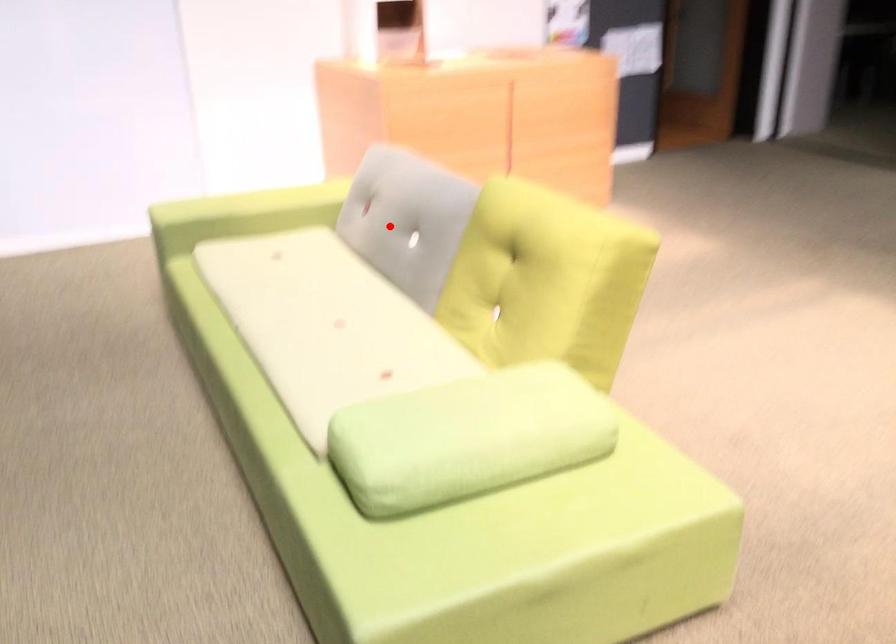
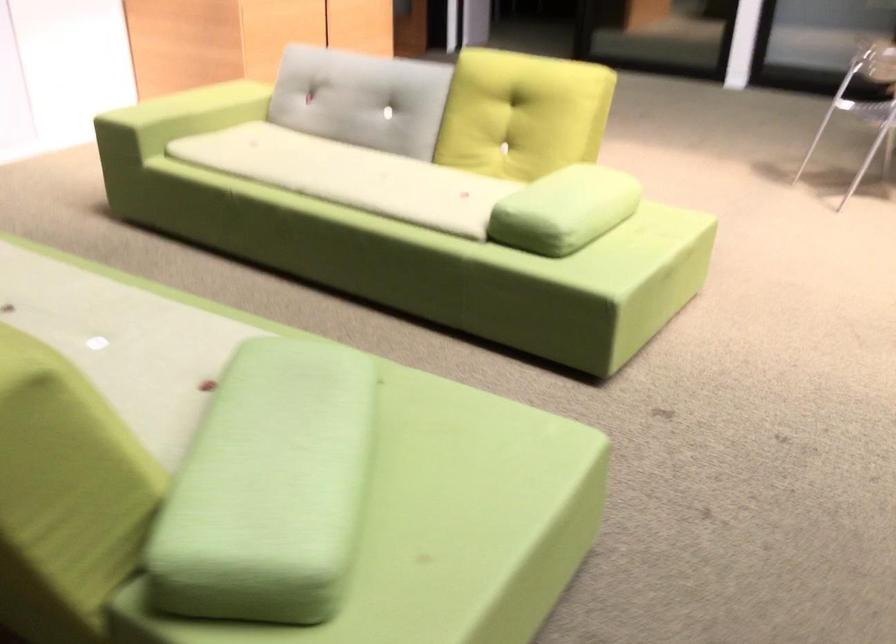
Question: I am providing you with two images of the same scene from different viewpoints. A red point is shown in image1. For the corresponding object point in image2, is it positioned nearer or farther from the camera?

Choices:
 (A) Nearer
 (B) Farther

Answer: (B)